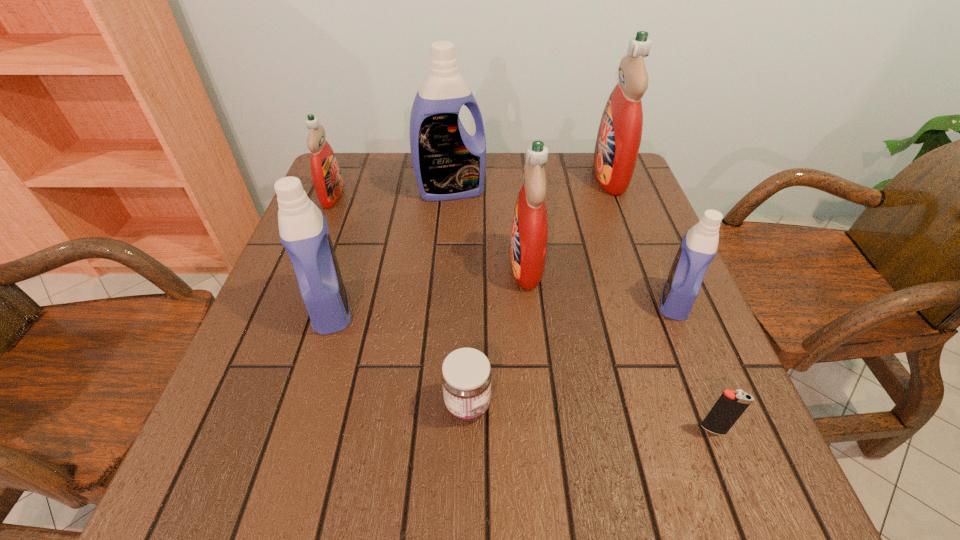
Where is `the biggest red detergent`? This screenshot has width=960, height=540. the biggest red detergent is located at coordinates (619, 136).

You are a GUI agent. You are given a task and a screenshot of the screen. Output one action in this format:
    pyautogui.click(x=<x>, y=<y>)
    Task: Click on the farthest blue detergent
    The height and width of the screenshot is (540, 960).
    Given the screenshot: What is the action you would take?
    pyautogui.click(x=449, y=164)

Locate an element on the screen. The height and width of the screenshot is (540, 960). the second blue detergent from left to right is located at coordinates (449, 164).

The image size is (960, 540). I want to click on the third detergent from right to left, so click(x=529, y=234).

This screenshot has height=540, width=960. Find the location of `the fourth object from right to left`. the fourth object from right to left is located at coordinates (529, 234).

Find the location of a particular element. the second biggest blue detergent is located at coordinates (303, 229).

Where is `the leftmost blue detergent`? This screenshot has width=960, height=540. the leftmost blue detergent is located at coordinates pos(303,229).

Identify the location of the smallest red detergent. (325, 171).

The height and width of the screenshot is (540, 960). Identify the location of the leftmost red detergent. (325, 171).

You are a GUI agent. You are given a task and a screenshot of the screen. Output one action in this format:
    pyautogui.click(x=<x>, y=<y>)
    Task: Click on the smallest blue detergent
    This screenshot has width=960, height=540.
    Given the screenshot: What is the action you would take?
    pyautogui.click(x=699, y=246)